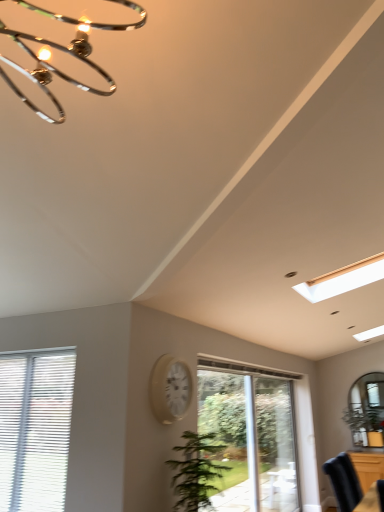
Question: Is brown wooden dresser at lower right far away from white blinds at lower left, arranged as the 1th window when viewed from the left?

Choices:
 (A) no
 (B) yes

Answer: (B)

Question: Is brown wooden dresser at lower right touching white blinds at lower left, positioned as the second window in right-to-left order?

Choices:
 (A) no
 (B) yes

Answer: (A)

Question: From a real-world perspective, is brown wooden dresser at lower right located higher than white blinds at lower left, acting as the 1th window starting from the front?

Choices:
 (A) no
 (B) yes

Answer: (A)

Question: Considering the relative sizes of brown wooden dresser at lower right and white blinds at lower left, positioned as the second window in right-to-left order, in the image provided, is brown wooden dresser at lower right bigger than white blinds at lower left, positioned as the second window in right-to-left order,?

Choices:
 (A) yes
 (B) no

Answer: (A)

Question: Is brown wooden dresser at lower right taller than white blinds at lower left, positioned as the second window in right-to-left order?

Choices:
 (A) yes
 (B) no

Answer: (B)

Question: Is brown wooden dresser at lower right facing towards white blinds at lower left, arranged as the 1th window when viewed from the left?

Choices:
 (A) no
 (B) yes

Answer: (B)

Question: Can you confirm if white glossy clock at center is positioned to the right of green leafy plant at center?

Choices:
 (A) yes
 (B) no

Answer: (B)

Question: Can you confirm if white glossy clock at center is shorter than green leafy plant at center?

Choices:
 (A) yes
 (B) no

Answer: (A)

Question: Considering the relative sizes of white glossy clock at center and green leafy plant at center in the image provided, is white glossy clock at center smaller than green leafy plant at center?

Choices:
 (A) no
 (B) yes

Answer: (B)

Question: Can we say white glossy clock at center lies outside green leafy plant at center?

Choices:
 (A) yes
 (B) no

Answer: (A)

Question: From a real-world perspective, is white glossy clock at center below green leafy plant at center?

Choices:
 (A) no
 (B) yes

Answer: (A)

Question: Is white glossy clock at center oriented towards green leafy plant at center?

Choices:
 (A) no
 (B) yes

Answer: (A)

Question: From a real-world perspective, is clear glass door at center, marked as the 1th window in a right-to-left arrangement, on top of clear glass door at center?

Choices:
 (A) yes
 (B) no

Answer: (A)